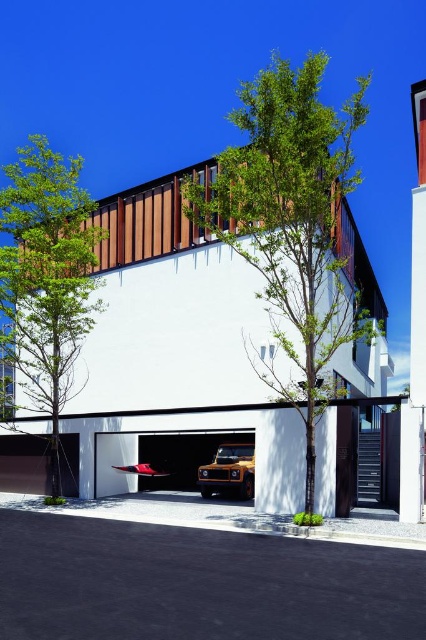
You are a landscape architect designing a pathway between the green leafy tree at center and the white glossy garage door at center. Which object has a wider base to consider for spacing?

The green leafy tree at center has a wider base than the white glossy garage door at center, so you should consider the tree when planning the pathway spacing.

You are a delivery person trying to park a truck that is 3 meters wide. You see the white glossy garage door at center and the white matte garage door at lower left. Which garage door can accommodate your truck?

The white glossy garage door at center has a greater width than the white matte garage door at lower left, so the truck can fit through the white glossy garage door at center.